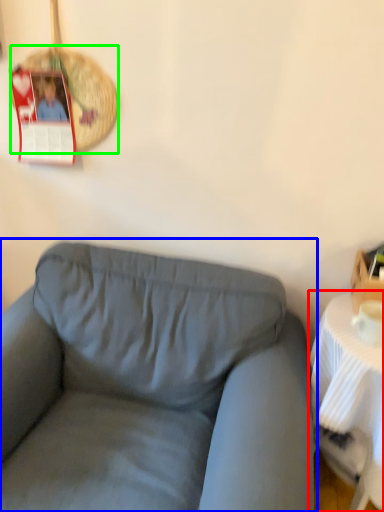
Question: Which object is positioned closest to table (highlighted by a red box)? Select from studio couch (highlighted by a blue box) and basket (highlighted by a green box).

Choices:
 (A) studio couch
 (B) basket

Answer: (A)